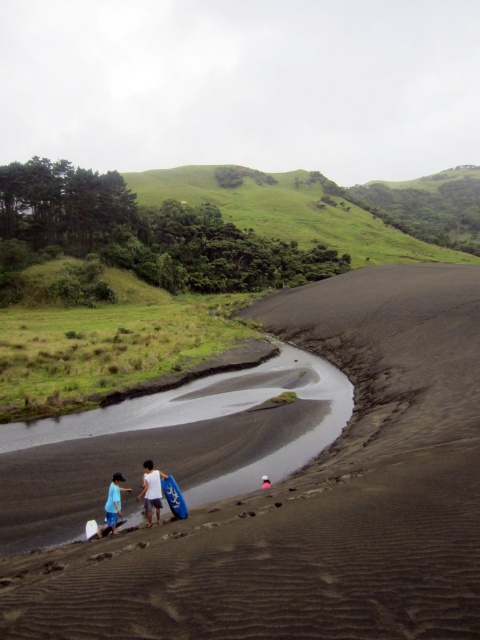
You are a photographer positioned at the edge of the sandy beach. You want to take a photo of both the blue fabric shirt at lower left and the blue matte surfboard at lower center without any obstruction. Based on their positions, which object should you adjust your camera angle to focus on first to ensure both are visible?

The blue matte surfboard at lower center is behind the blue fabric shirt at lower left, so you should focus on the blue fabric shirt at lower left first to ensure it doesn t block the surfboard in the photo.

You are a surfer planning to ride waves in the river. You have two surfboards available, the white matte surfboard at lower center and the blue foam surfboard at lower left. Which surfboard should you choose based on their sizes?

The white matte surfboard at lower center is larger in size than the blue foam surfboard at lower left, so you should choose the white matte surfboard at lower center for better stability and control in the river waves.